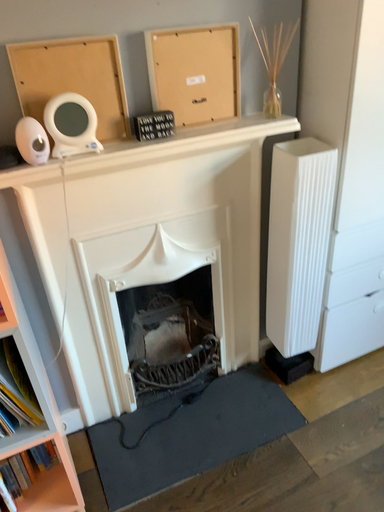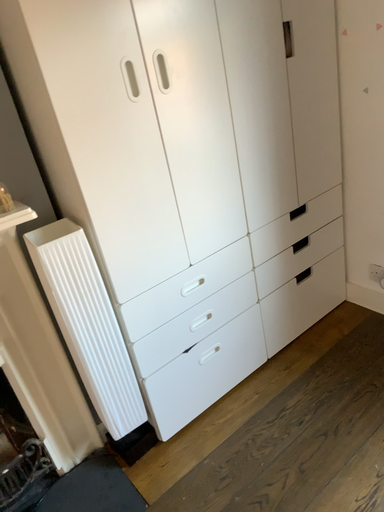
Question: How did the camera likely rotate when shooting the video?

Choices:
 (A) rotated downward
 (B) rotated upward

Answer: (B)